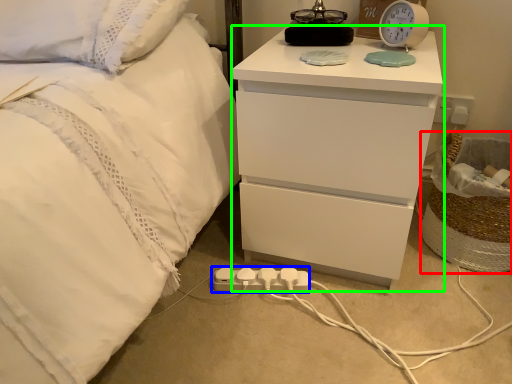
Question: Which object is the closest to the laundry basket (highlighted by a red box)? Choose among these: extension cord (highlighted by a blue box) or nightstand (highlighted by a green box).

Choices:
 (A) extension cord
 (B) nightstand

Answer: (B)